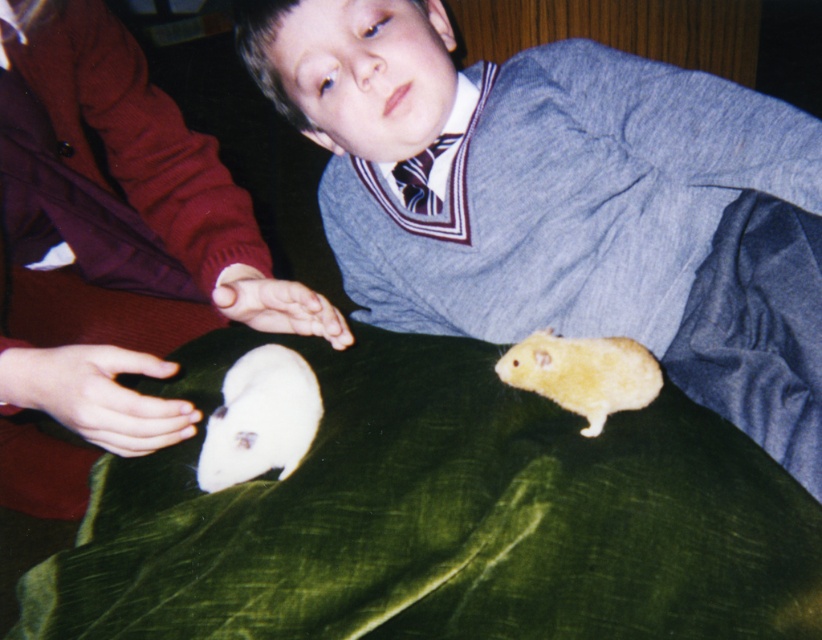
Which is more to the left, matte gray sweater at center or white fur mouse at lower left?

Positioned to the left is white fur mouse at lower left.

Is matte gray sweater at center shorter than white fur mouse at lower left?

No.

Who is more distant from viewer, (813, 316) or (276, 406)?

The point (276, 406) is behind.

Image resolution: width=822 pixels, height=640 pixels. Find the location of `matte gray sweater at center`. matte gray sweater at center is located at coordinates (562, 200).

Is white fur mouse at lower left to the left of golden fur hamster at lower right from the viewer's perspective?

Correct, you'll find white fur mouse at lower left to the left of golden fur hamster at lower right.

What are the coordinates of `white fur mouse at lower left` in the screenshot? It's located at (261, 419).

Is point (243, 371) farther from viewer compared to point (619, 372)?

Yes, it is behind point (619, 372).

Find the location of a particular element. white fur mouse at lower left is located at coordinates (261, 419).

Is matte gray sweater at center to the left of golden fur hamster at lower right from the viewer's perspective?

Indeed, matte gray sweater at center is positioned on the left side of golden fur hamster at lower right.

Image resolution: width=822 pixels, height=640 pixels. What do you see at coordinates (562, 200) in the screenshot? I see `matte gray sweater at center` at bounding box center [562, 200].

This screenshot has height=640, width=822. What do you see at coordinates (562, 200) in the screenshot?
I see `matte gray sweater at center` at bounding box center [562, 200].

Locate an element on the screen. Image resolution: width=822 pixels, height=640 pixels. matte gray sweater at center is located at coordinates (562, 200).